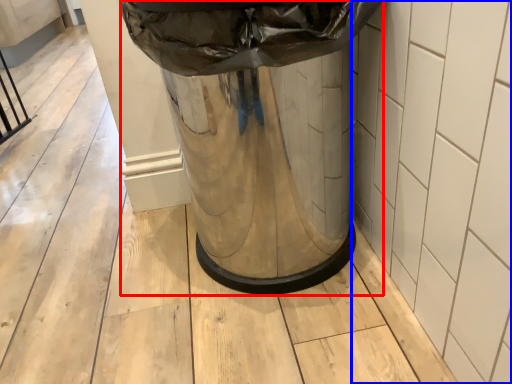
Question: Which object is further to the camera taking this photo, waste container (highlighted by a red box) or tile (highlighted by a blue box)?

Choices:
 (A) waste container
 (B) tile

Answer: (A)